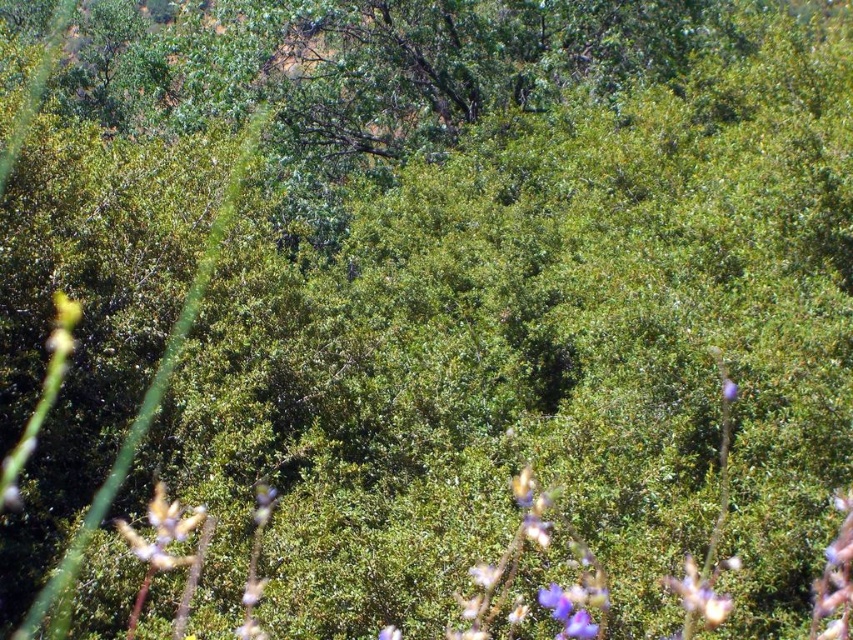
Question: Which of the following is the closest to the observer?

Choices:
 (A) (709, 624)
 (B) (172, 566)

Answer: (A)

Question: Where is purple matte flower at lower left located in relation to purple matte flower at lower right in the image?

Choices:
 (A) left
 (B) right

Answer: (A)

Question: Estimate the real-world distances between objects in this image. Which object is closer to the purple matte flower at upper right?

Choices:
 (A) purple matte flower at lower left
 (B) purple matte flower at lower right

Answer: (B)

Question: Does purple matte flower at lower right appear on the left side of purple matte flower at upper right?

Choices:
 (A) yes
 (B) no

Answer: (A)

Question: Considering the relative positions of purple matte flower at lower right and purple matte flower at upper right in the image provided, where is purple matte flower at lower right located with respect to purple matte flower at upper right?

Choices:
 (A) above
 (B) below

Answer: (B)

Question: Based on their relative distances, which object is nearer to the purple matte flower at lower right?

Choices:
 (A) purple matte flower at lower left
 (B) purple matte flower at upper right

Answer: (B)